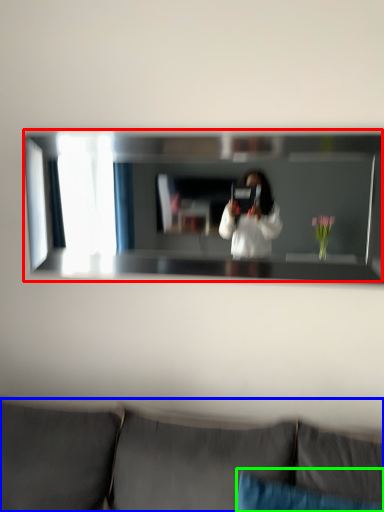
Question: Estimate the real-world distances between objects in this image. Which object is farther from mirror (highlighted by a red box), studio couch (highlighted by a blue box) or pillow (highlighted by a green box)?

Choices:
 (A) studio couch
 (B) pillow

Answer: (B)